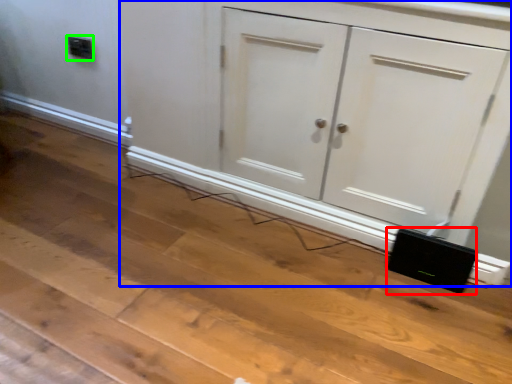
Question: Which object is the closest to the speaker (highlighted by a red box)? Choose among these: cupboard (highlighted by a blue box) or electric outlet (highlighted by a green box).

Choices:
 (A) cupboard
 (B) electric outlet

Answer: (A)